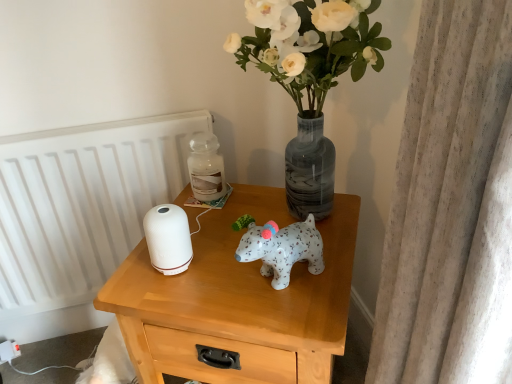
You are a GUI agent. You are given a task and a screenshot of the screen. Output one action in this format:
    pyautogui.click(x=<x>, y=<y>)
    Task: Click on the vacant space situated above white matte nightstand at center (from a real-world perspective)
    The image size is (512, 384).
    Given the screenshot: What is the action you would take?
    pyautogui.click(x=244, y=263)